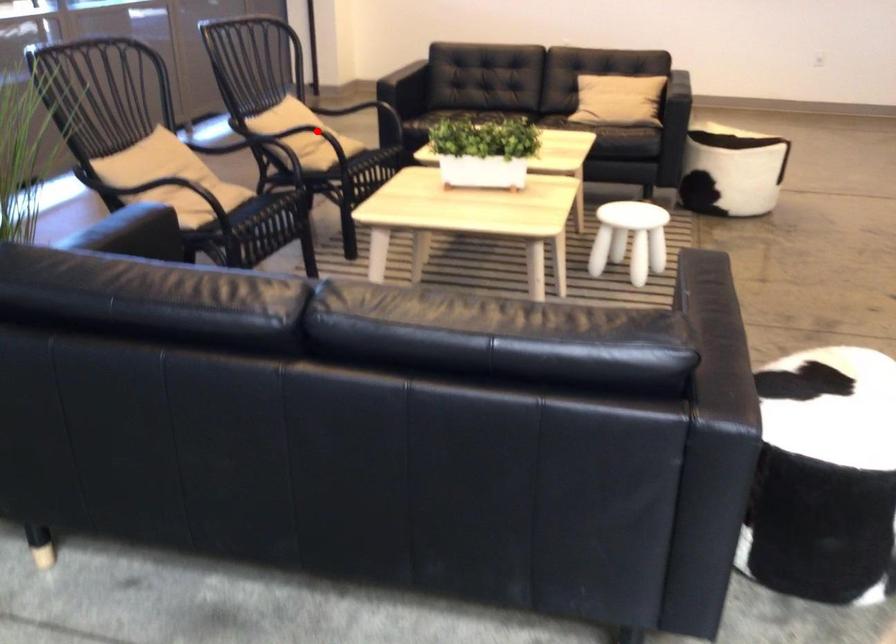
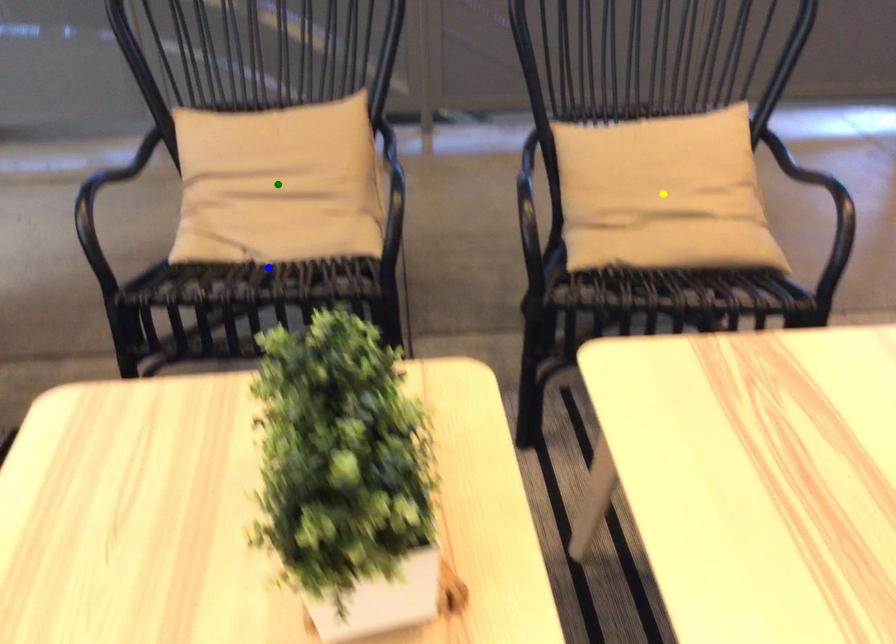
Question: I am providing you with two images of the same scene from different viewpoints. A red point is marked on the first image. You are given multiple points on the second image. Can you choose the point in image 2 that corresponds to the point in image 1?

Choices:
 (A) blue point
 (B) yellow point
 (C) green point

Answer: (B)